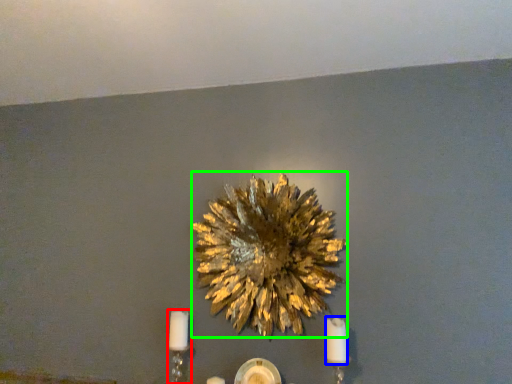
Question: Which object is the farthest from candle holder (highlighted by a red box)? Choose among these: candle (highlighted by a blue box) or flower (highlighted by a green box).

Choices:
 (A) candle
 (B) flower

Answer: (A)